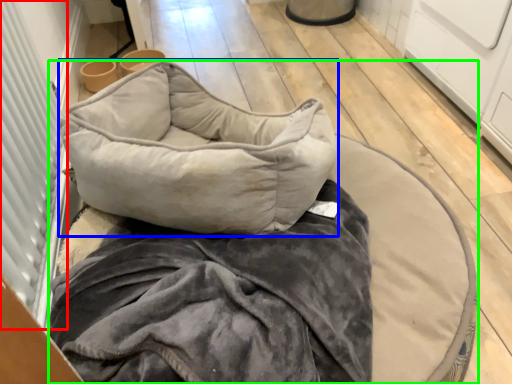
Question: Estimate the real-world distances between objects in this image. Which object is farther from screen door (highlighted by a red box), pillow (highlighted by a blue box) or furniture (highlighted by a green box)?

Choices:
 (A) pillow
 (B) furniture

Answer: (B)